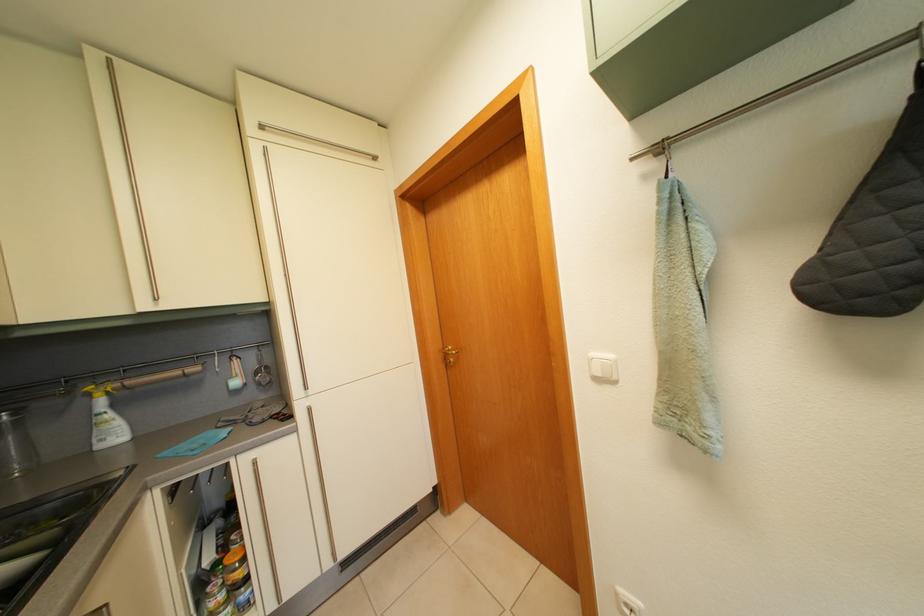
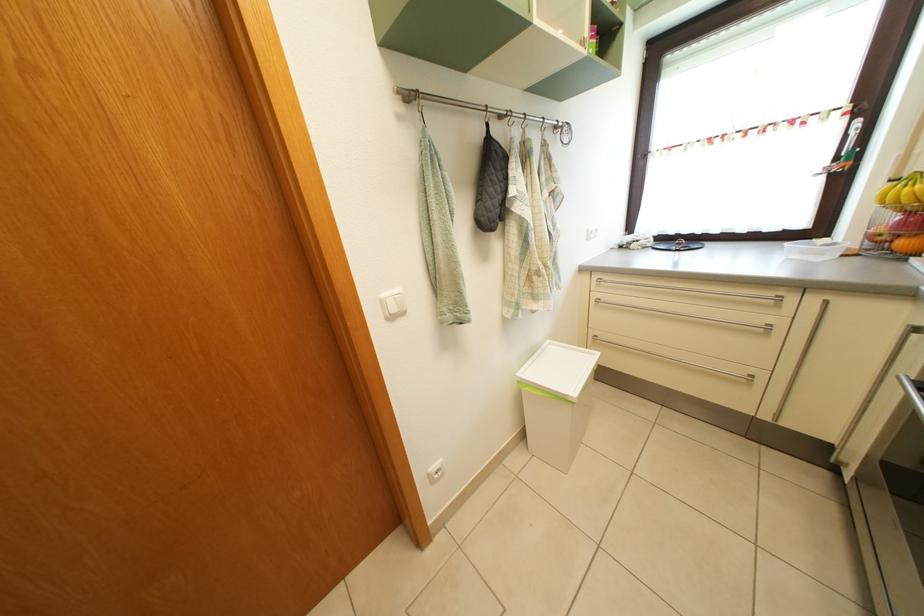
Locate, in the second image, the point that corresponds to (601,362) in the first image.

(392, 302)